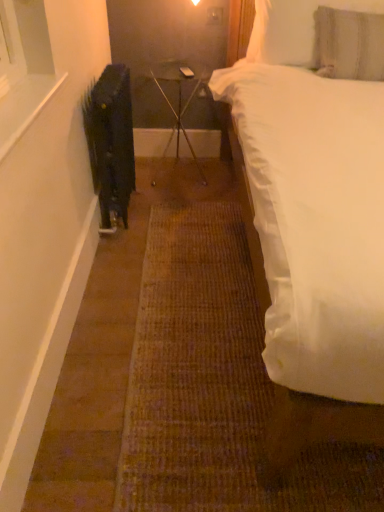
Question: From a real-world perspective, is white soft pillow at upper right, placed as the 1th pillow when sorted from top to bottom, positioned above or below textured gray pillow at upper right, the 2th pillow when ordered from top to bottom?

Choices:
 (A) above
 (B) below

Answer: (A)

Question: In the image, is white soft pillow at upper right, the 2th pillow positioned from the bottom, on the left side or the right side of textured gray pillow at upper right, which is the first pillow in bottom-to-top order?

Choices:
 (A) right
 (B) left

Answer: (B)

Question: Which object is the farthest from the clear glass table at center?

Choices:
 (A) textured gray pillow at upper right, which is the first pillow in bottom-to-top order
 (B) white soft bed at right
 (C) white soft pillow at upper right, the 2th pillow positioned from the bottom
 (D) black matte radiator at left

Answer: (B)

Question: Which object is positioned farthest from the textured gray pillow at upper right, the 2th pillow when ordered from top to bottom?

Choices:
 (A) white soft pillow at upper right, placed as the 1th pillow when sorted from top to bottom
 (B) clear glass table at center
 (C) black matte radiator at left
 (D) white soft bed at right

Answer: (C)